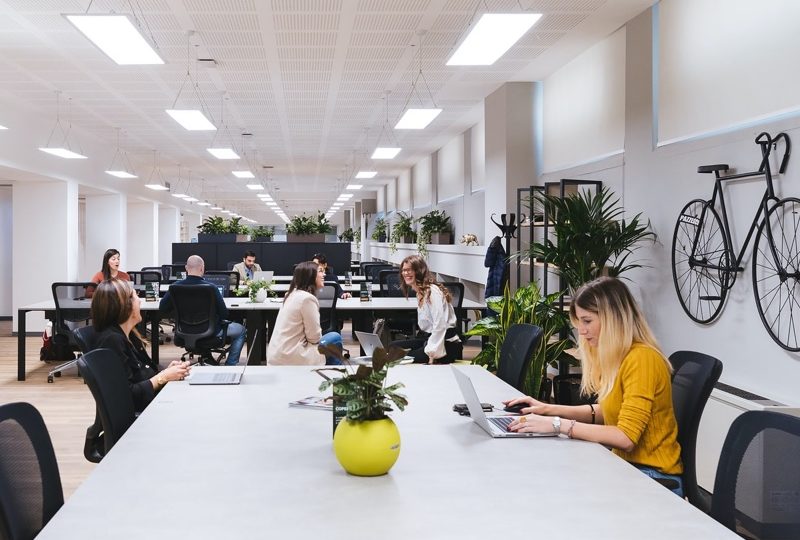
You are a GUI agent. You are given a task and a screenshot of the screen. Output one action in this format:
    pyautogui.click(x=<x>, y=<y>)
    Task: Click on the computers
    
    Given the screenshot: What is the action you would take?
    pyautogui.click(x=470, y=408), pyautogui.click(x=369, y=337), pyautogui.click(x=244, y=362), pyautogui.click(x=222, y=288), pyautogui.click(x=270, y=272), pyautogui.click(x=133, y=283)